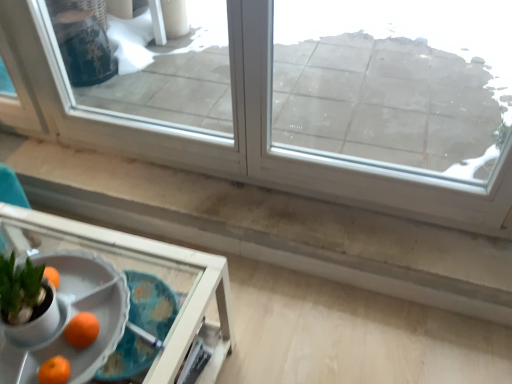
This screenshot has height=384, width=512. I want to click on free area below transparent glass window at upper center, the 1th window positioned from the left (from a real-world perspective), so click(x=211, y=176).